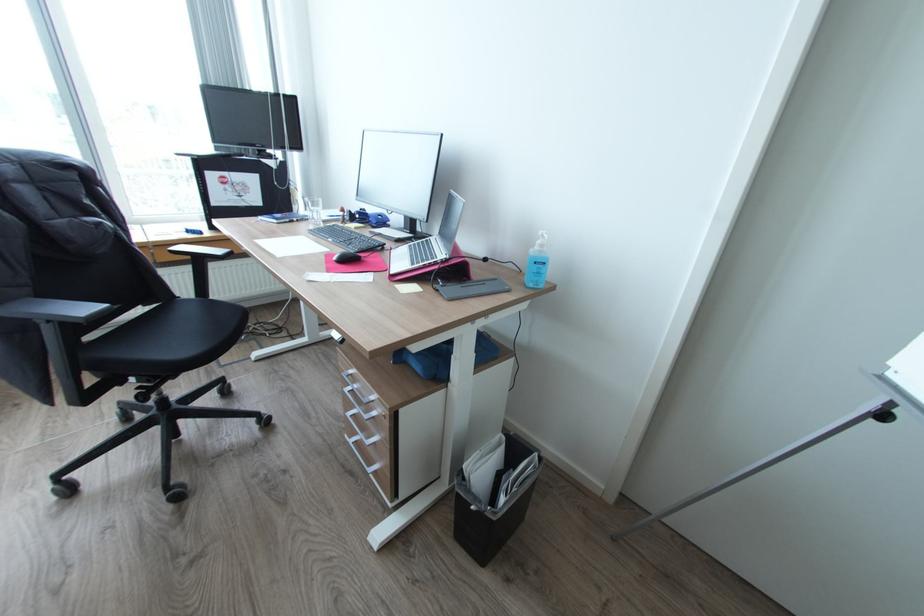
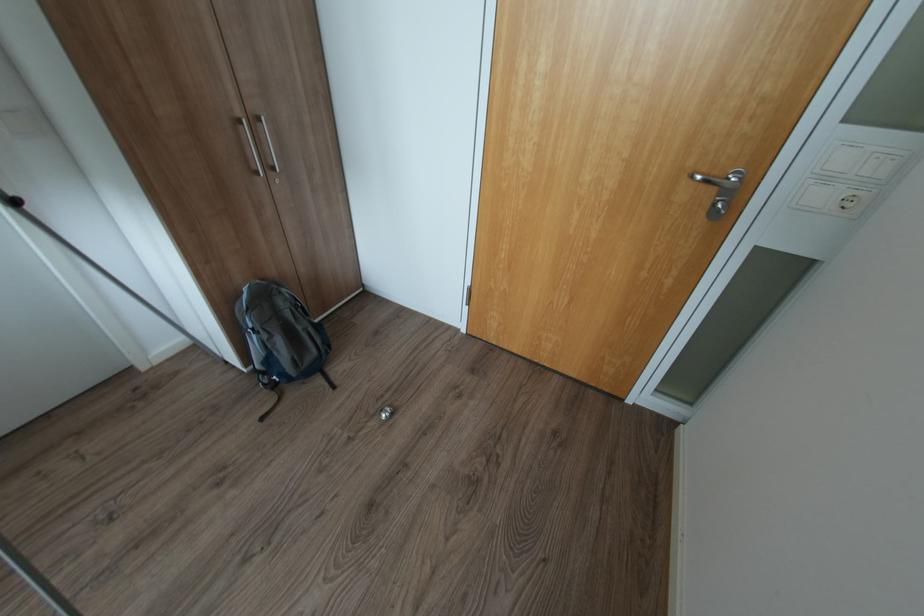
Based on the continuous images, in which direction is the camera rotating?

The rotation direction of the camera is right-down.